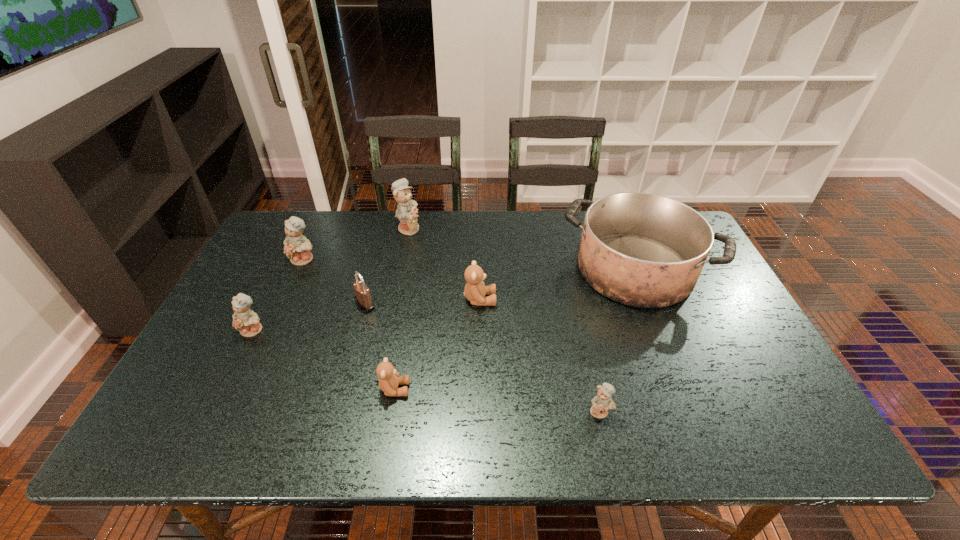
Locate an element on the screen. the nearer brown teddy bear is located at coordinates (388, 376).

Image resolution: width=960 pixels, height=540 pixels. Identify the location of the seventh farthest object. (388, 376).

Image resolution: width=960 pixels, height=540 pixels. Find the location of `the nearest teddy bear`. the nearest teddy bear is located at coordinates (601, 403).

Locate an element on the screen. The width and height of the screenshot is (960, 540). the nearest object is located at coordinates (601, 403).

Where is `free location located 0.140m on the front-facing side of the farthest blue teddy bear`? Image resolution: width=960 pixels, height=540 pixels. free location located 0.140m on the front-facing side of the farthest blue teddy bear is located at coordinates (463, 228).

The image size is (960, 540). I want to click on vacant area situated 0.220m on the left of the saucepan, so click(x=489, y=269).

You are a GUI agent. You are given a task and a screenshot of the screen. Output one action in this format:
    pyautogui.click(x=<x>, y=<y>)
    Task: Click on the vacant space situated on the front-facing side of the second tallest teddy bear
    
    Given the screenshot: What is the action you would take?
    pyautogui.click(x=272, y=329)

I want to click on vacant region located on the face of the second teddy bear from right to left, so click(539, 300).

At what (x,y) coordinates should I click in order to perform the action: click on vacant space positioned 0.260m on the front-facing side of the sixth farthest object. Please return your answer as a coordinate pair (x, y). This screenshot has height=540, width=960. Looking at the image, I should click on (202, 433).

Locate an element on the screen. This screenshot has width=960, height=540. free point located 0.060m on the back of the padlock is located at coordinates (372, 281).